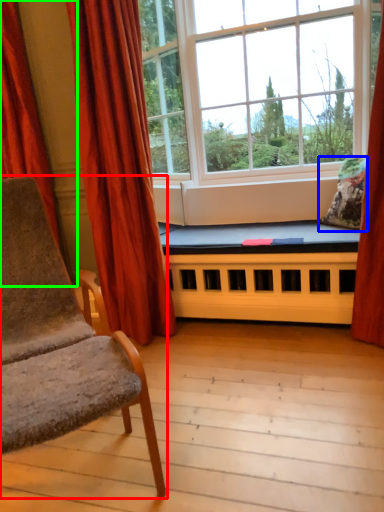
Question: Based on their relative distances, which object is farther from chair (highlighted by a red box)? Choose from pillow (highlighted by a blue box) and curtain (highlighted by a green box).

Choices:
 (A) pillow
 (B) curtain

Answer: (A)